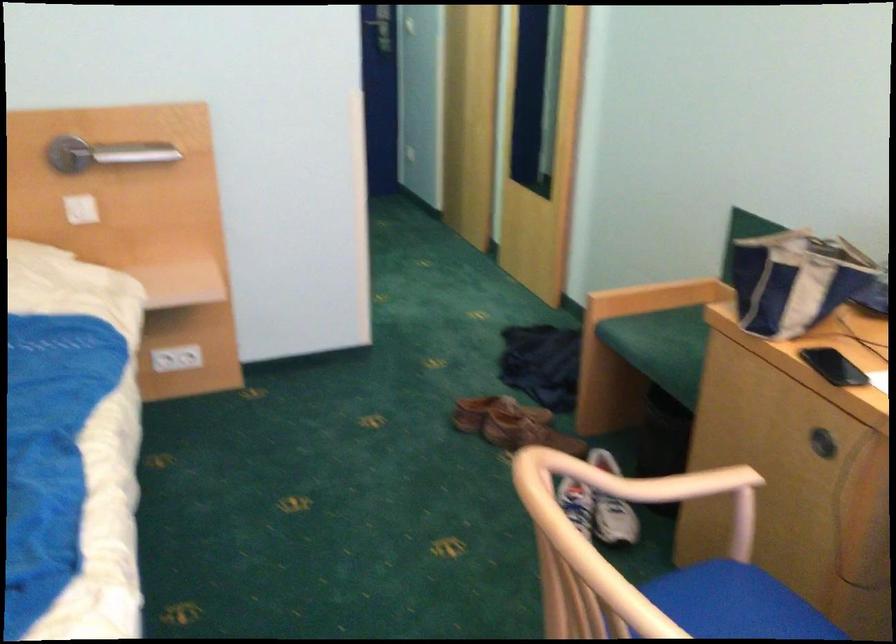
Find the location of a particular element. white sneakers is located at coordinates (607, 543).